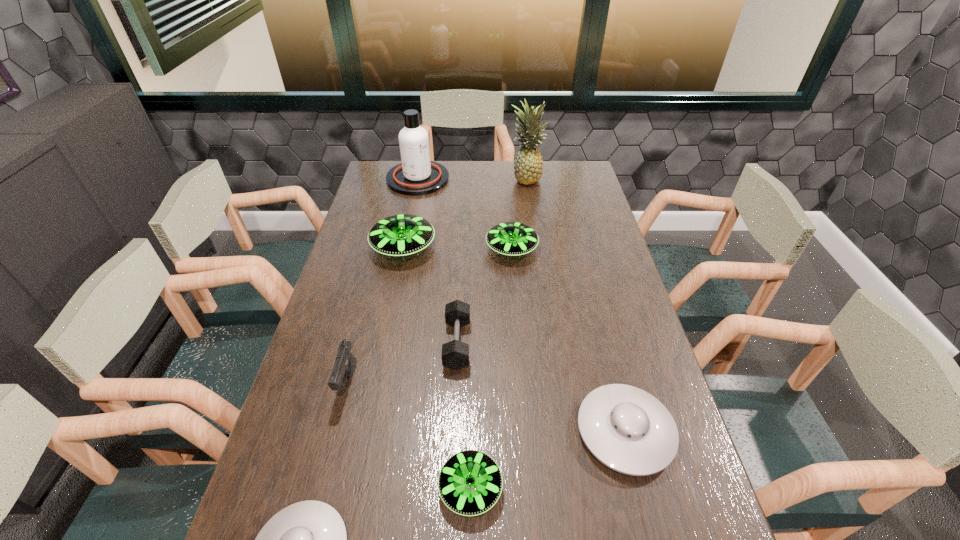
You are a GUI agent. You are given a task and a screenshot of the screen. Output one action in this format:
    pyautogui.click(x=<x>, y=<y>)
    Task: Click on the nearest green saucer
    This screenshot has width=960, height=540.
    Given the screenshot: What is the action you would take?
    pyautogui.click(x=470, y=482)

Find the location of a particular element. The image size is (960, 540). free spot located on the left of the green pineapple is located at coordinates (449, 179).

At what (x,y) coordinates should I click in order to perform the action: click on vacant space located 0.060m on the right of the second tallest object. Please return your answer as a coordinate pair (x, y). Image resolution: width=960 pixels, height=540 pixels. Looking at the image, I should click on (463, 179).

At what (x,y) coordinates should I click in order to perform the action: click on vacant space located on the back of the biggest green saucer. Please return your answer as a coordinate pair (x, y). The image size is (960, 540). Looking at the image, I should click on (415, 193).

This screenshot has width=960, height=540. I want to click on blank space located 0.170m at the barrel of the black pistol, so click(324, 478).

The image size is (960, 540). Find the location of `free space located on the front of the second biggest green saucer`. free space located on the front of the second biggest green saucer is located at coordinates (516, 294).

You are a GUI agent. You are given a task and a screenshot of the screen. Output one action in this format:
    pyautogui.click(x=<x>, y=<y>)
    Task: Click on the vacant space located on the left of the dumbbell
    
    Given the screenshot: What is the action you would take?
    pyautogui.click(x=312, y=343)

Where is `free space located 0.230m on the back of the farther gray saucer`? Image resolution: width=960 pixels, height=540 pixels. free space located 0.230m on the back of the farther gray saucer is located at coordinates (597, 322).

At what (x,y) coordinates should I click in order to perform the action: click on blank space located 0.160m on the left of the nearest green saucer. Please return your answer as a coordinate pair (x, y). Looking at the image, I should click on (364, 488).

I want to click on pineapple positioned at the far edge, so click(528, 167).